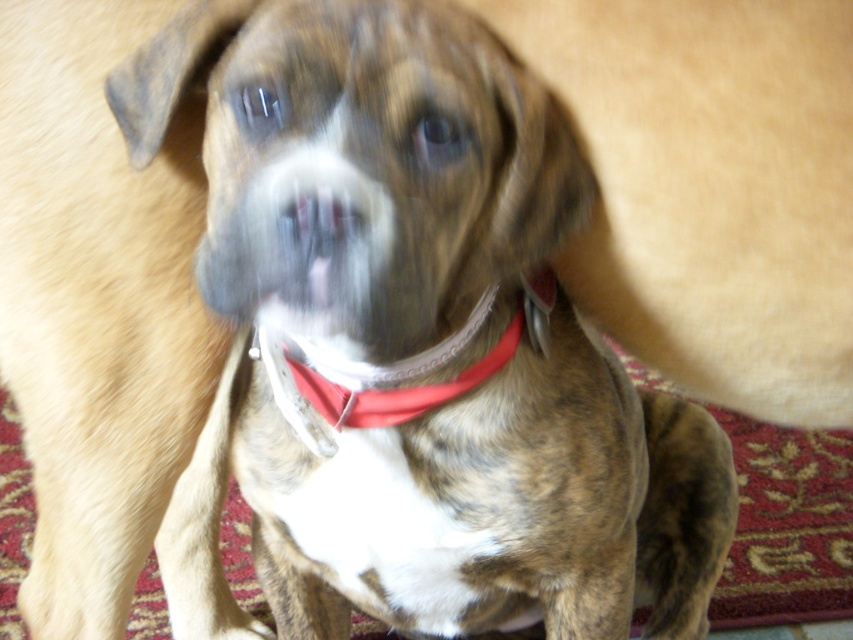
Question: Observing the image, what is the correct spatial positioning of brown fur dog at center in reference to red fabric neckband at center?

Choices:
 (A) above
 (B) below

Answer: (B)

Question: Which point is farther to the camera?

Choices:
 (A) (283, 356)
 (B) (560, 522)

Answer: (B)

Question: Does brown fur dog at center appear under red fabric neckband at center?

Choices:
 (A) yes
 (B) no

Answer: (A)

Question: Is brown fur dog at center wider than red fabric neckband at center?

Choices:
 (A) no
 (B) yes

Answer: (B)